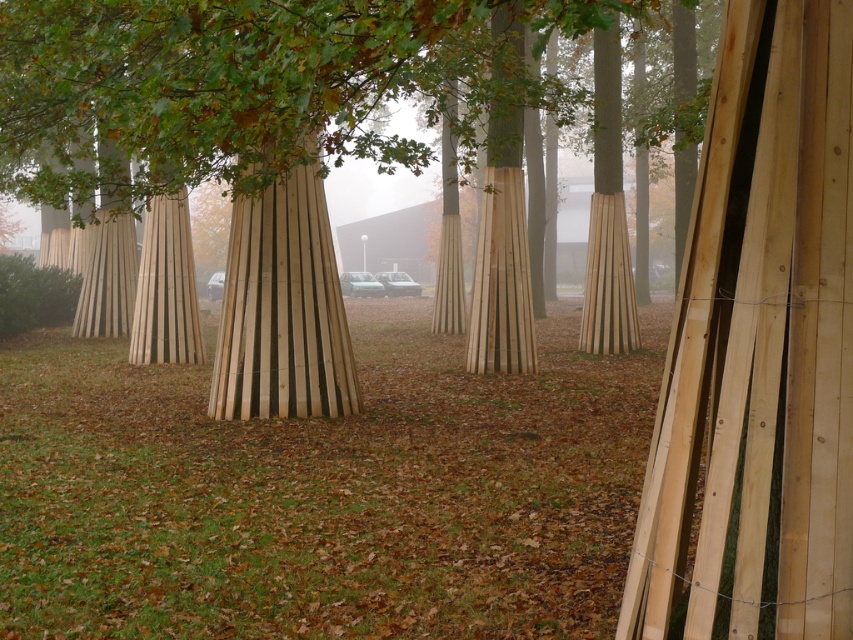
Question: Which of the following is the farthest from the observer?

Choices:
 (A) natural wood tree at center
 (B) natural wood pillar at center

Answer: (B)

Question: Which point is closer to the camera?

Choices:
 (A) natural wood pillar at center
 (B) natural wood tree at center

Answer: (B)

Question: Can you confirm if natural wood tree at center is positioned to the right of natural wood pillar at center?

Choices:
 (A) yes
 (B) no

Answer: (B)

Question: Does natural wood tree at center appear on the right side of natural wood pillar at center?

Choices:
 (A) no
 (B) yes

Answer: (A)

Question: Is natural wood tree at center positioned before natural wood pillar at center?

Choices:
 (A) no
 (B) yes

Answer: (B)